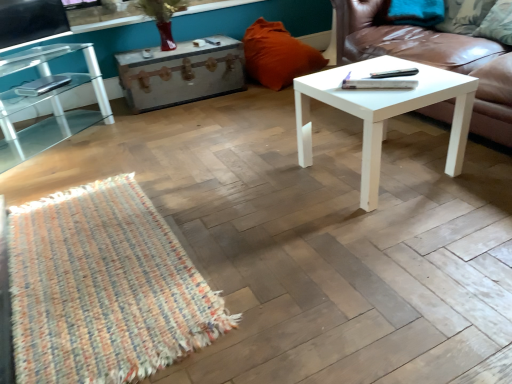
I want to click on vacant space situated on the left part of white matte coffee table at center, so click(x=267, y=183).